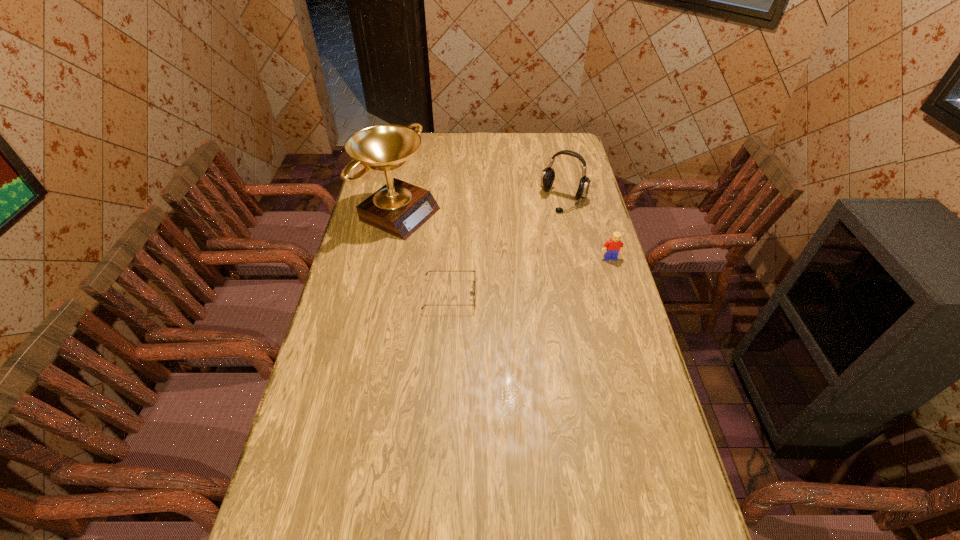
Find the location of a particular element. The width and height of the screenshot is (960, 540). free spot located with the microphone on the side of the headset is located at coordinates (545, 232).

Identify the location of free region located on the front-facing side of the tallest object. (482, 247).

Where is `vacant area situated on the front-facing side of the tallest object`? The image size is (960, 540). vacant area situated on the front-facing side of the tallest object is located at coordinates (511, 259).

Find the location of `vacant space situated 0.060m on the front-facing side of the tallest object`. vacant space situated 0.060m on the front-facing side of the tallest object is located at coordinates (445, 232).

The image size is (960, 540). I want to click on object present at the left edge, so click(399, 208).

The width and height of the screenshot is (960, 540). I want to click on Lego positioned at the right edge, so click(614, 245).

Identify the location of headset present at the right edge. (548, 175).

The image size is (960, 540). Identify the location of vacant space at the far edge. (532, 148).

In the image, there is a desktop. Identify the location of vacant space at the near edge. The image size is (960, 540). (551, 494).

Locate an element on the screen. free spot at the left edge of the desktop is located at coordinates (320, 375).